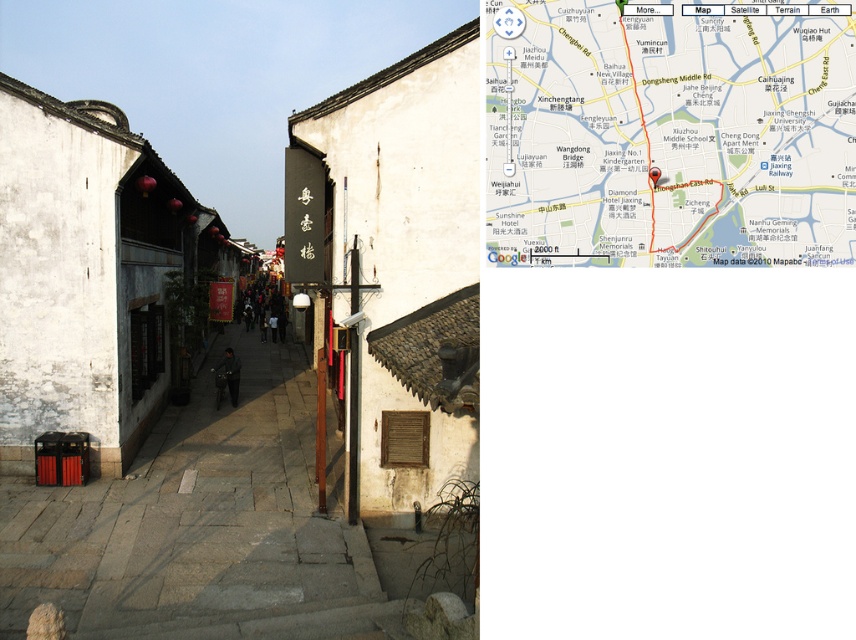
You are a tourist holding a white paper map at center and standing on gray stone stairs at lower center. You want to fold the map to put it in your pocket. Which object do you need to handle first?

The white paper map at center has a smaller size compared to gray stone stairs at lower center, so you need to handle the white paper map at center first to fold it before dealing with the stairs.

You are a delivery person trying to navigate through the narrow street. The matte stone alley at center and the gray stone stairs at lower center are both potential paths. Which path is wider and more suitable for carrying a large package?

The matte stone alley at center is wider than the gray stone stairs at lower center, so it is more suitable for carrying a large package.